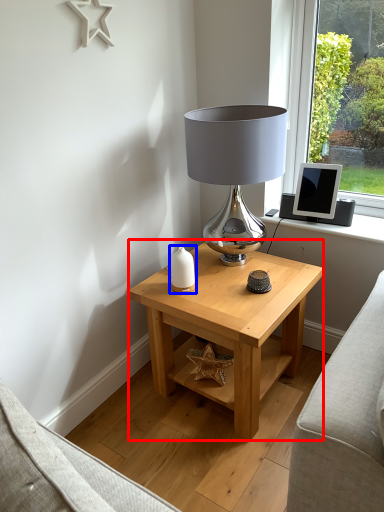
Question: Which of the following is the closest to the observer, table (highlighted by a red box) or candle holder (highlighted by a blue box)?

Choices:
 (A) table
 (B) candle holder

Answer: (A)